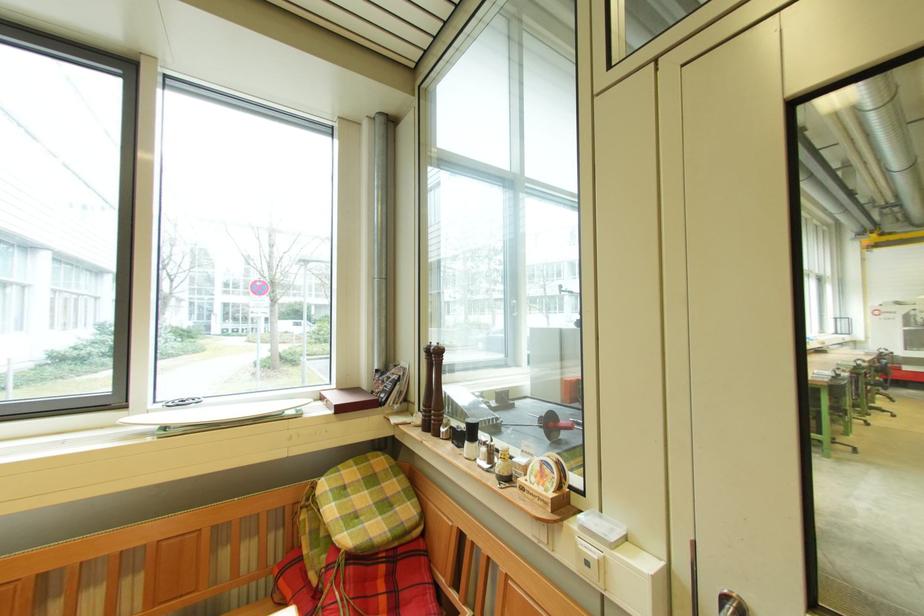
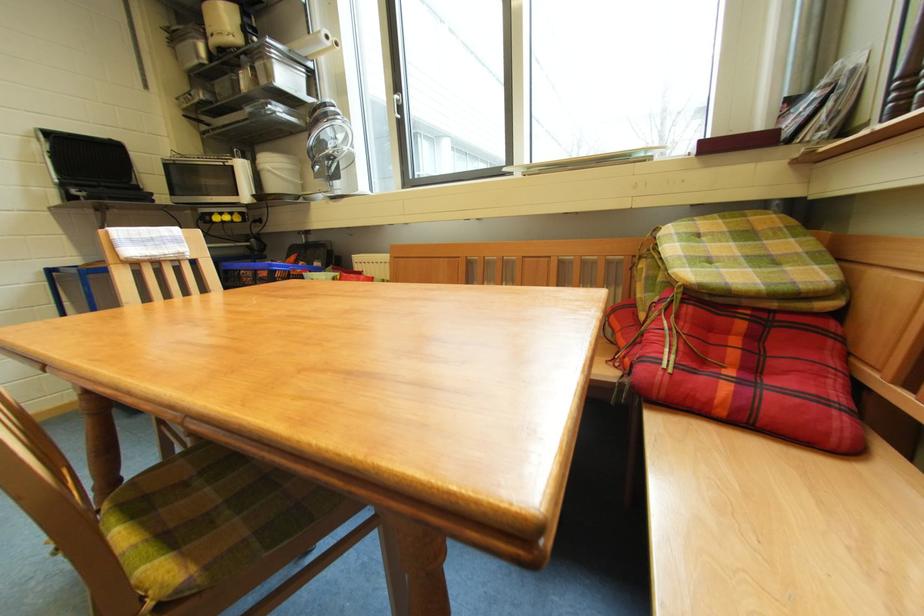
Locate, in the second image, the point that corresponds to the point at 359,570 in the first image.

(698, 310)